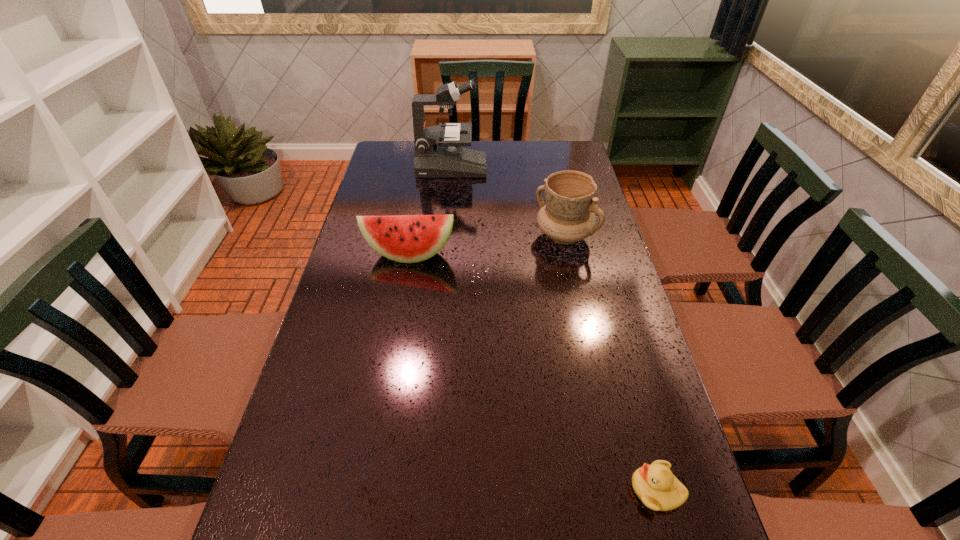
Where is `free region at the right edge of the desktop`? The image size is (960, 540). free region at the right edge of the desktop is located at coordinates (653, 530).

The width and height of the screenshot is (960, 540). In the image, there is a desktop. What are the coordinates of `free space at the far left corner` in the screenshot? It's located at (413, 163).

I want to click on free location at the far right corner of the desktop, so click(x=544, y=147).

Image resolution: width=960 pixels, height=540 pixels. In order to click on empty location between the second tallest object and the watermelon in this screenshot , I will do `click(487, 245)`.

Where is `free area in between the second shortest object and the shortest object`? The image size is (960, 540). free area in between the second shortest object and the shortest object is located at coordinates [533, 372].

This screenshot has height=540, width=960. In order to click on free space between the watermelon and the nearest object in this screenshot , I will do `click(533, 372)`.

You are a GUI agent. You are given a task and a screenshot of the screen. Output one action in this format:
    pyautogui.click(x=<x>, y=<y>)
    Task: Click on the free space between the shortest object and the watermelon
    
    Given the screenshot: What is the action you would take?
    pyautogui.click(x=533, y=372)

What are the coordinates of `free space between the farthest object and the shortest object` in the screenshot? It's located at (554, 328).

Point out which object is positioned as the nearest to the tallest object. Please provide its 2D coordinates. Your answer should be formatted as a tuple, i.e. [(x, y)], where the tuple contains the x and y coordinates of a point satisfying the conditions above.

[(568, 215)]

Point out which object is positioned as the second nearest to the shortest object. Please provide its 2D coordinates. Your answer should be formatted as a tuple, i.e. [(x, y)], where the tuple contains the x and y coordinates of a point satisfying the conditions above.

[(403, 238)]